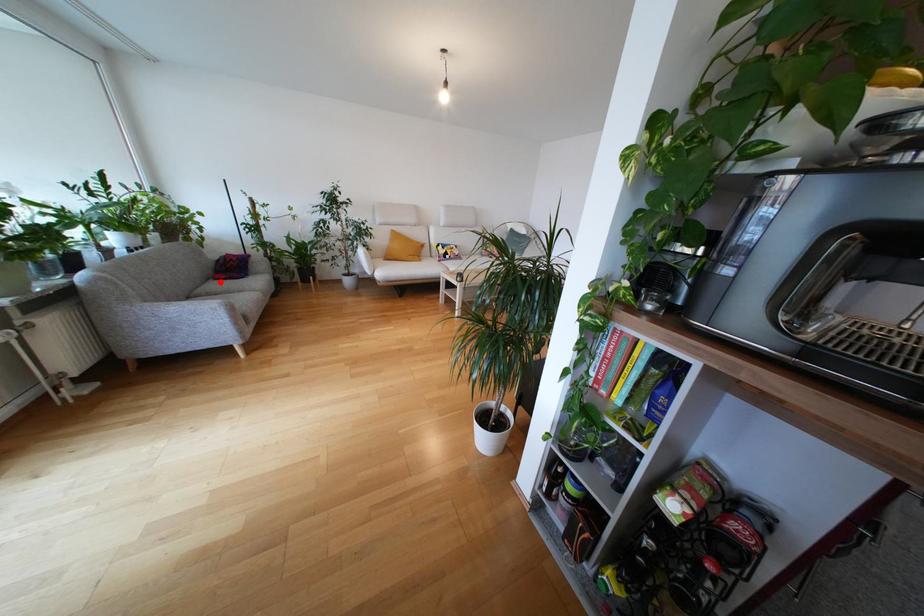
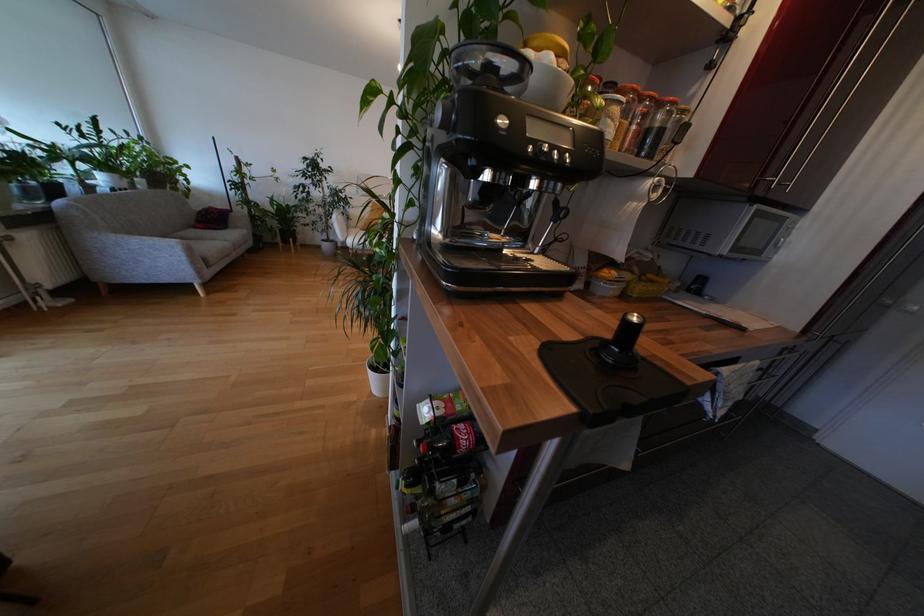
In the second image, find the point that corresponds to the highlighted location in the first image.

(200, 230)